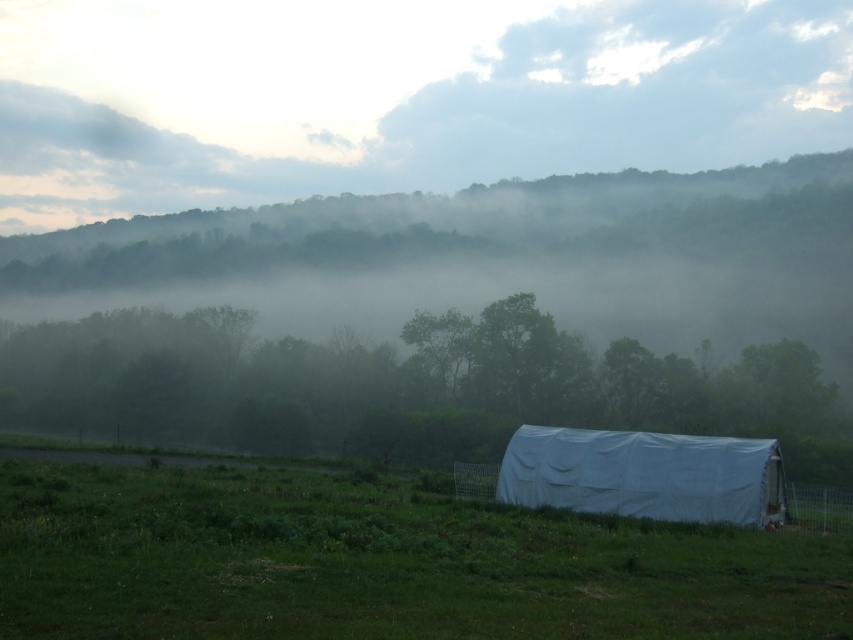
Question: Which object appears farthest from the camera in this image?

Choices:
 (A) white fabric tent at lower center
 (B) green grassy field at lower center

Answer: (A)

Question: Is green grassy field at lower center smaller than white fabric tent at lower center?

Choices:
 (A) yes
 (B) no

Answer: (B)

Question: Can you confirm if green grassy field at lower center is smaller than white fabric tent at lower center?

Choices:
 (A) yes
 (B) no

Answer: (B)

Question: Among these objects, which one is farthest from the camera?

Choices:
 (A) white fabric tent at lower center
 (B) green grassy field at lower center

Answer: (A)

Question: Is green grassy field at lower center thinner than white fabric tent at lower center?

Choices:
 (A) no
 (B) yes

Answer: (A)